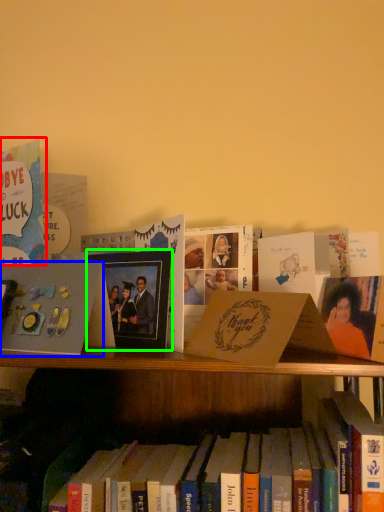
Question: Considering the real-world distances, which object is farthest from book (highlighted by a red box)? paperback book (highlighted by a blue box) or picture frame (highlighted by a green box)?

Choices:
 (A) paperback book
 (B) picture frame

Answer: (B)